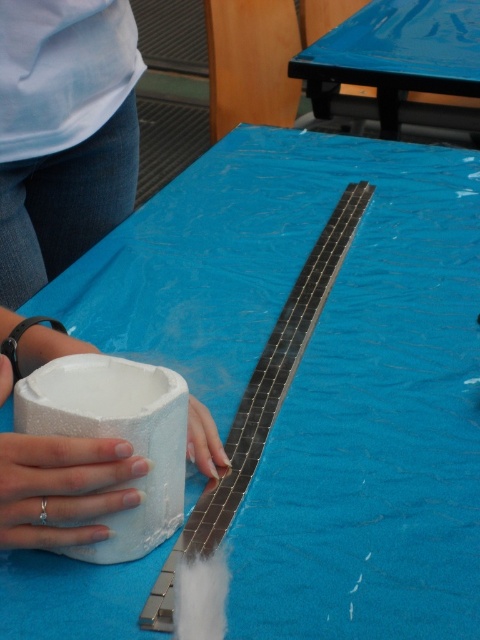
Question: Can you confirm if white matte shirt at upper left is bigger than white matte hand at center?

Choices:
 (A) no
 (B) yes

Answer: (B)

Question: Does white foam paper towel at lower left come behind silver metallic ring at lower left?

Choices:
 (A) yes
 (B) no

Answer: (A)

Question: Considering the relative positions of white foam paper towel at lower left and blue glossy table at upper center in the image provided, where is white foam paper towel at lower left located with respect to blue glossy table at upper center?

Choices:
 (A) above
 (B) below

Answer: (B)

Question: Which point appears closest to the camera in this image?

Choices:
 (A) (215, 480)
 (B) (58, 365)
 (C) (0, 218)

Answer: (B)

Question: Which point is closer to the camera?

Choices:
 (A) white matte shirt at upper left
 (B) white matte foam at lower left

Answer: (B)

Question: Which of these objects is positioned farthest from the white matte shirt at upper left?

Choices:
 (A) blue glossy table at upper center
 (B) white foam paper towel at lower left
 (C) silver metallic ring at lower left

Answer: (A)